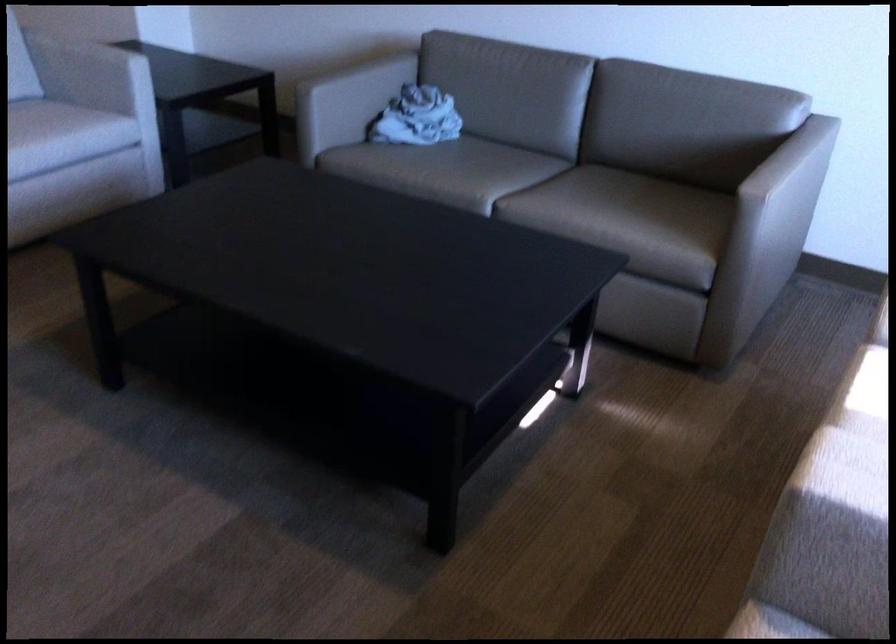
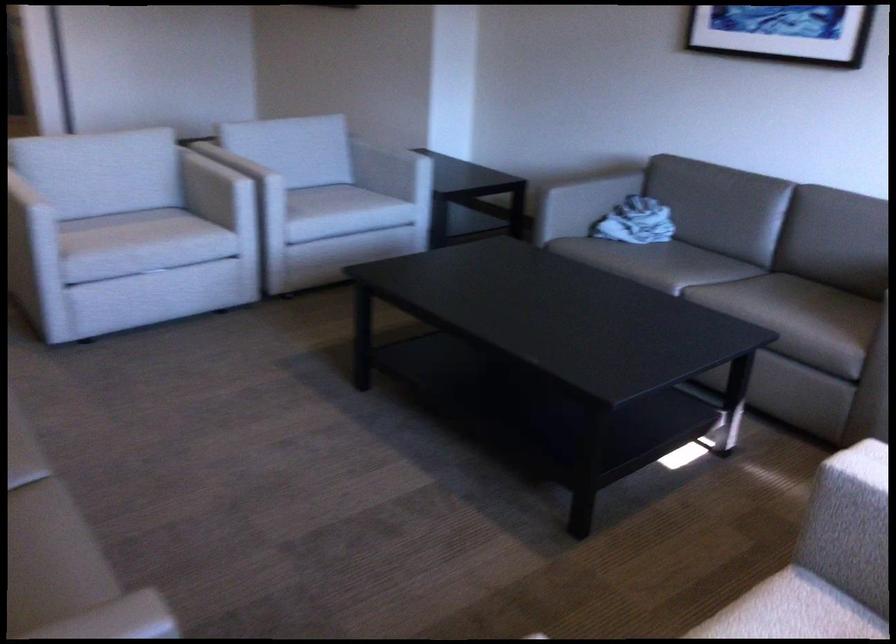
Question: Based on the continuous images, in which direction is the camera rotating? Reply with the corresponding letter.

Choices:
 (A) Left
 (B) Right
 (C) Up
 (D) Down

Answer: (A)